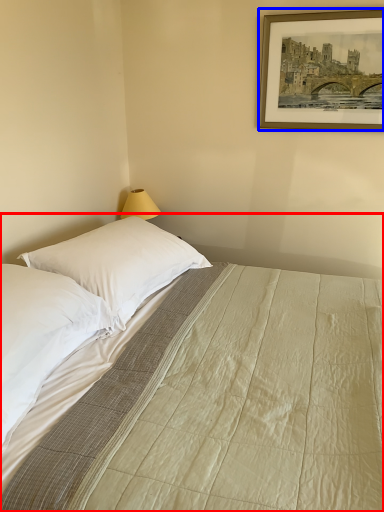
Question: Which point is further to the camera, bed (highlighted by a red box) or picture frame (highlighted by a blue box)?

Choices:
 (A) bed
 (B) picture frame

Answer: (B)